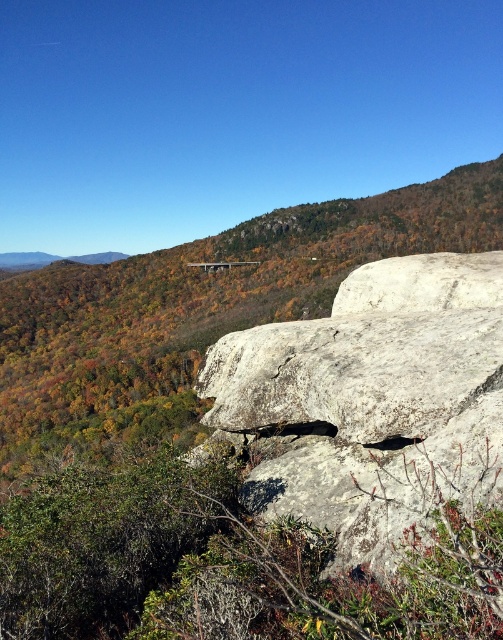
You are a hiker planning to cross the rocky terrain in the image. You need to step on the gray rough rock at center and the gray rough boulder at center. Which one should you choose to step on if you want to place your foot on the wider object?

The gray rough rock at center has a larger width than the gray rough boulder at center, so you should step on the gray rough rock at center.

You are a hiker carrying a backpack with a 12 inch wide tool kit. You need to place the tool kit between the gray rough rock at center and the gray rough boulder at center. Is there enough space?

The gray rough rock at center is 12.43 inches from the gray rough boulder at center, so yes, the 12 inch wide tool kit can fit between them since the distance is slightly larger than the tool kit.